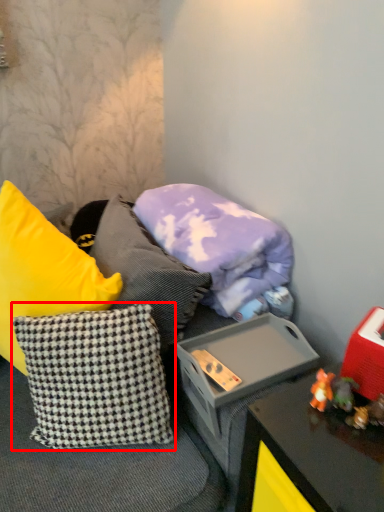
Question: In this image, where is pillow (annotated by the red box) located relative to pillow?

Choices:
 (A) right
 (B) left

Answer: (B)